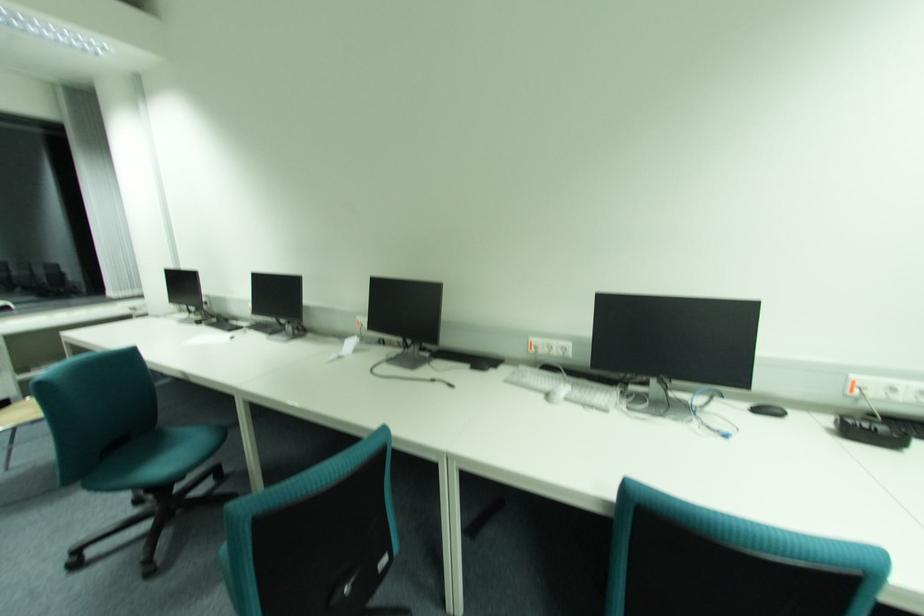
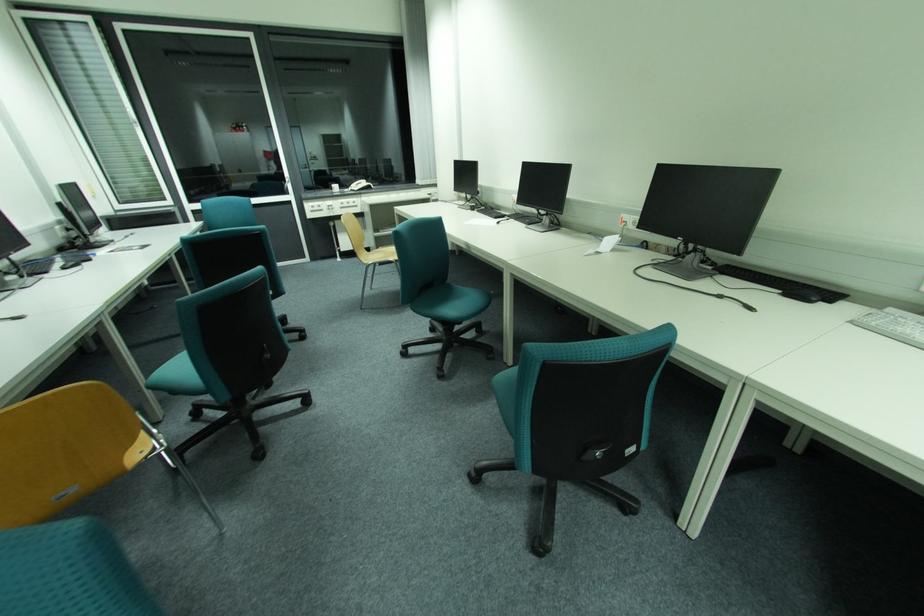
Find the pixel in the second image that matches pixel 165 468 in the first image.

(456, 310)